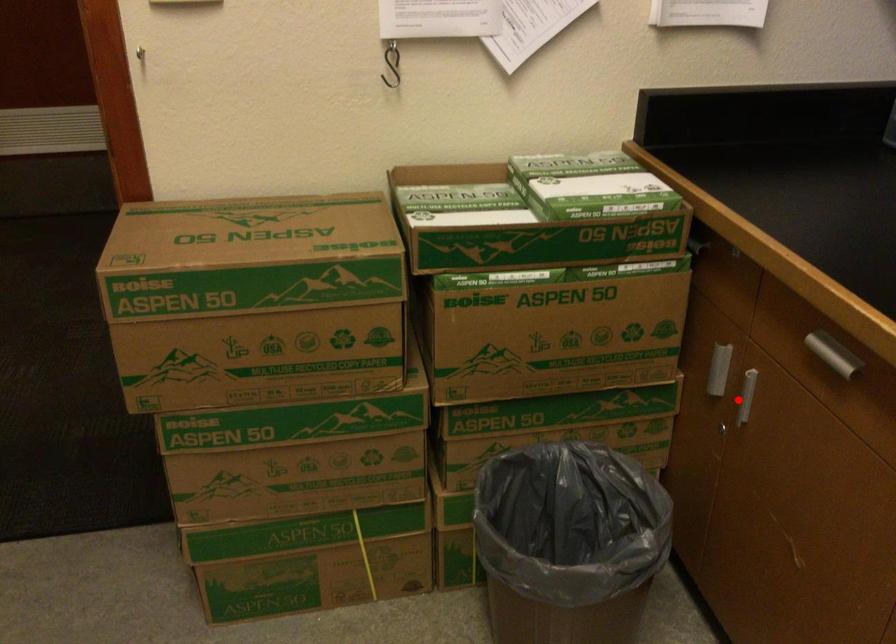
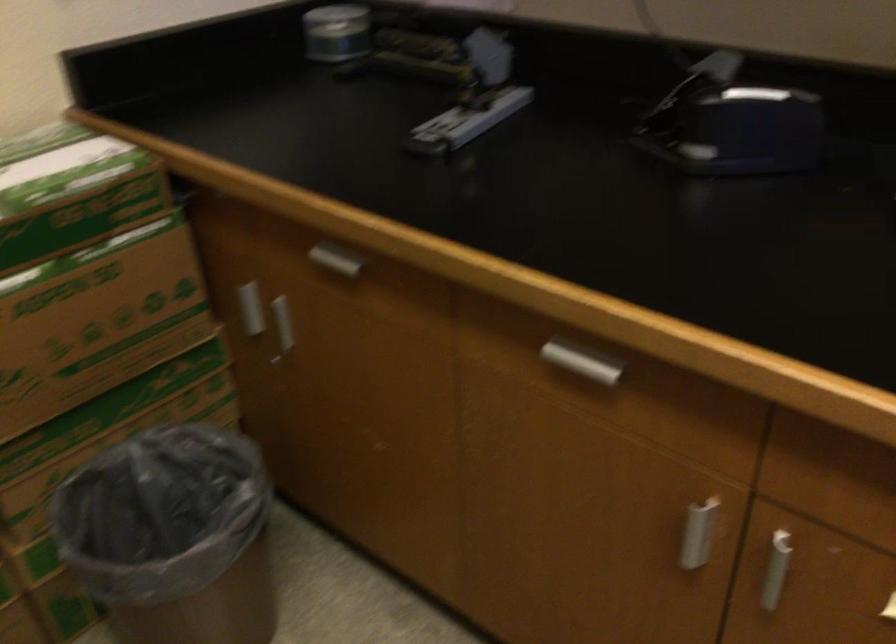
Locate, in the second image, the point that corresponds to the highlighted location in the first image.

(280, 327)